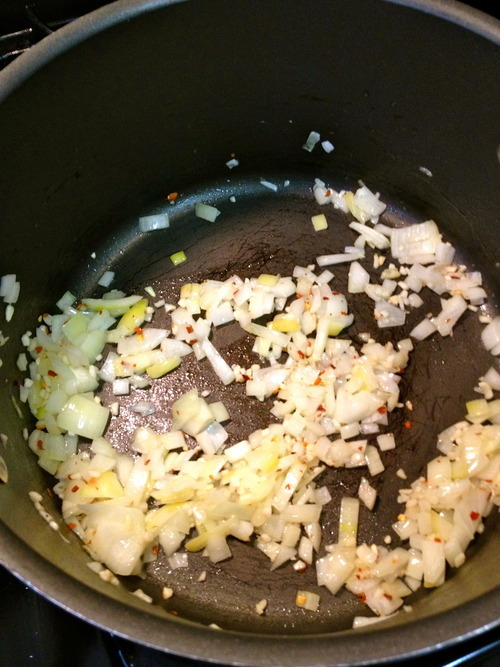
You are a GUI agent. You are given a task and a screenshot of the screen. Output one action in this format:
    pyautogui.click(x=<x>, y=<y>)
    Task: Click on the light reflection on cooking surface
    This screenshot has height=667, width=500.
    Given the screenshot: What is the action you would take?
    pyautogui.click(x=469, y=658)